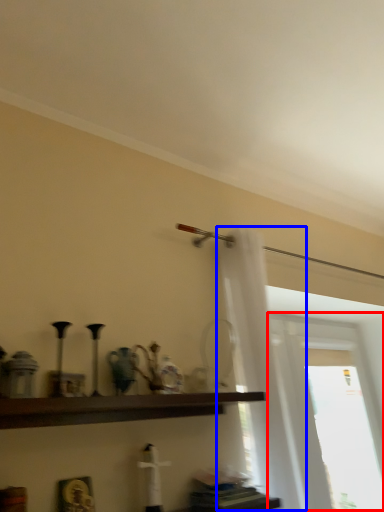
Question: Among these objects, which one is farthest to the camera, window (highlighted by a red box) or shower curtain (highlighted by a blue box)?

Choices:
 (A) window
 (B) shower curtain

Answer: (A)